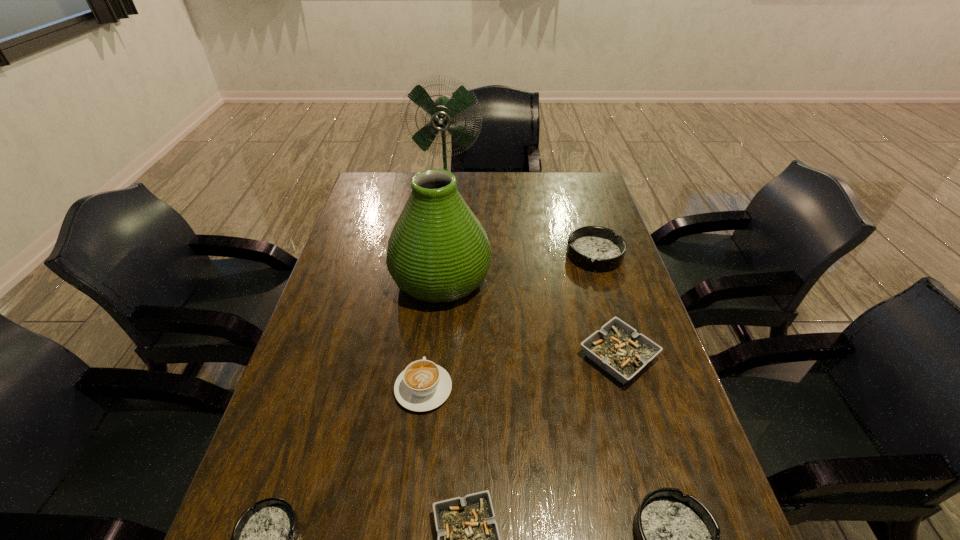
What are the coordinates of `the tallest object` in the screenshot? It's located at (442, 111).

The height and width of the screenshot is (540, 960). Identify the location of the farthest object. (442, 111).

This screenshot has height=540, width=960. I want to click on green vase, so click(438, 251).

At what (x,y) coordinates should I click in order to perform the action: click on the seventh shortest object. Please return your answer as a coordinate pair (x, y). Looking at the image, I should click on (438, 251).

Where is `cappuccino`? cappuccino is located at coordinates (423, 385).

Locate an element on the screen. the farthest dark ashtray is located at coordinates (593, 248).

At what (x,y) coordinates should I click in order to perform the action: click on the farthest ashtray. Please return your answer as a coordinate pair (x, y). Looking at the image, I should click on (593, 248).

Locate an element on the screen. The image size is (960, 540). the bigger gray ashtray is located at coordinates (617, 348).

Where is `the farther gray ashtray`? the farther gray ashtray is located at coordinates (617, 348).

Locate an element on the screen. Image resolution: width=960 pixels, height=540 pixels. free space located 0.260m on the front-facing side of the green fan is located at coordinates (441, 247).